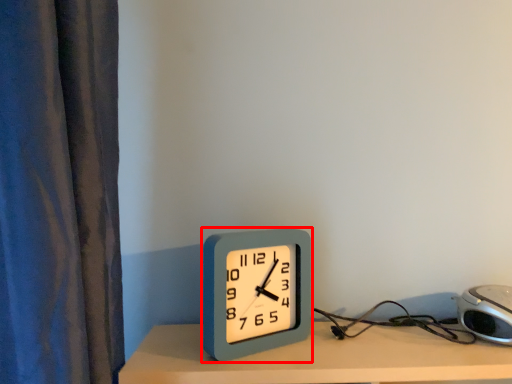
Question: Where is alarm clock (annotated by the red box) located in relation to alarm clock in the image?

Choices:
 (A) right
 (B) left

Answer: (B)